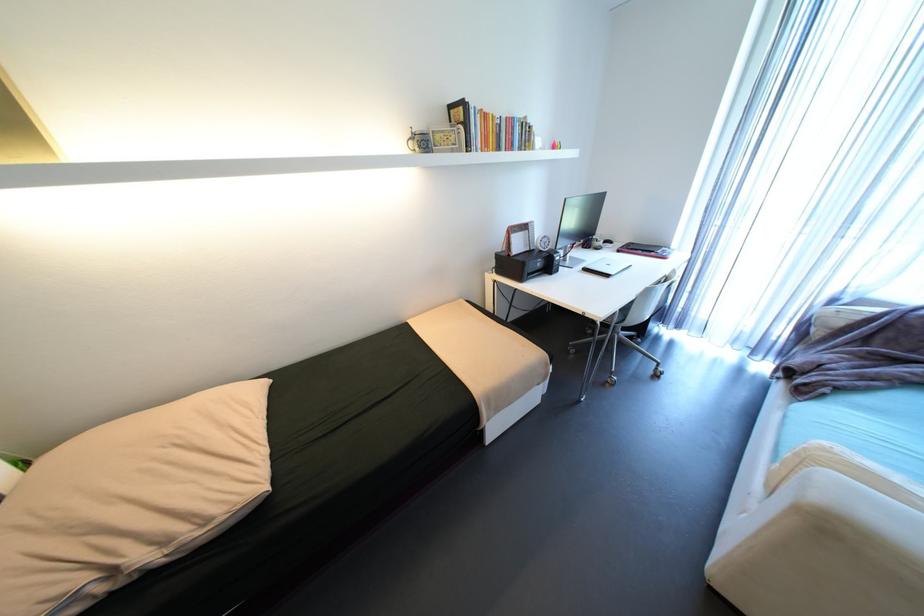
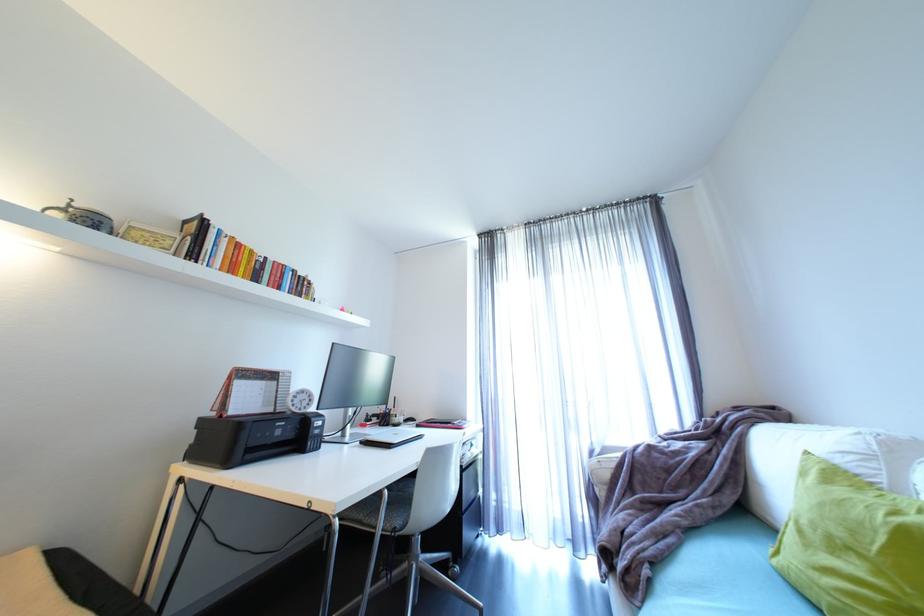
Where in the second image is the point corresponding to the point at 640,252 from the first image?

(440, 424)